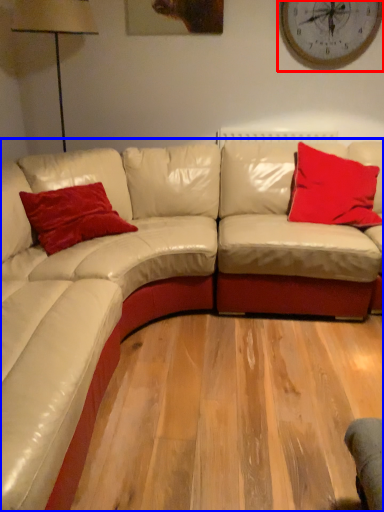
Question: Among these objects, which one is nearest to the camera, clock (highlighted by a red box) or studio couch (highlighted by a blue box)?

Choices:
 (A) clock
 (B) studio couch

Answer: (B)